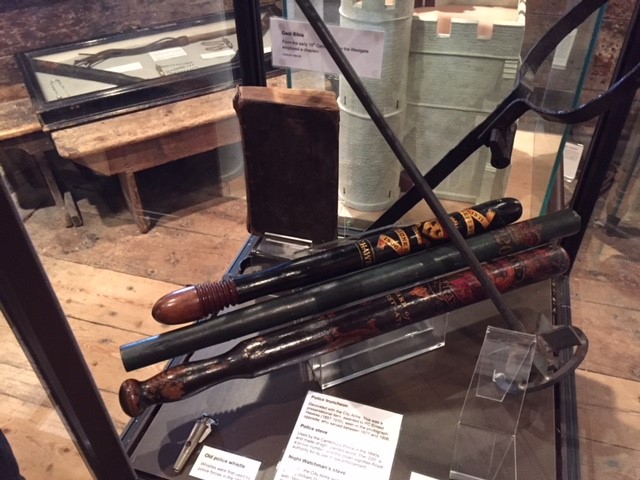
The height and width of the screenshot is (480, 640). In order to click on white card on horizontal surface in this screenshot , I will do tap(221, 463), tap(316, 455).